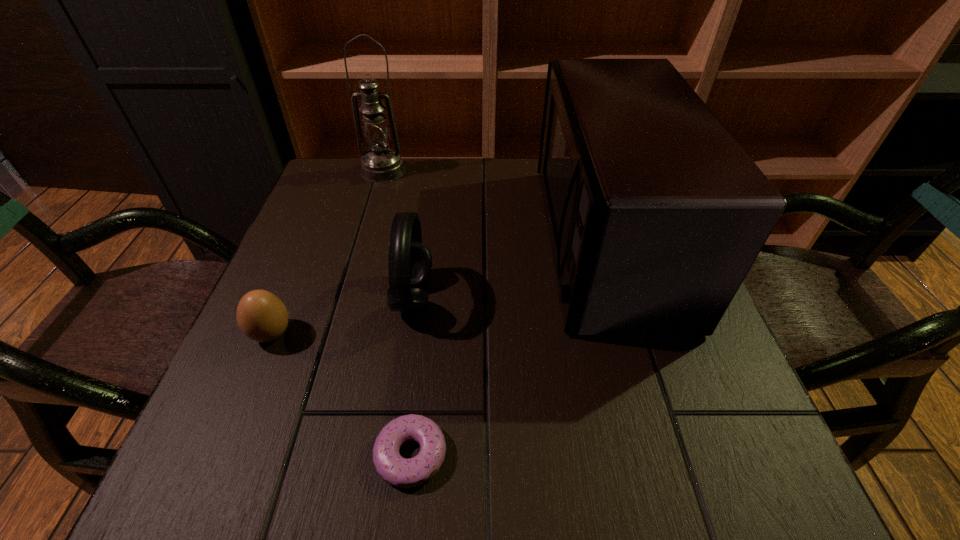
The height and width of the screenshot is (540, 960). Find the location of `unoccupied area between the leftmost object and the fourth object from right to left`. unoccupied area between the leftmost object and the fourth object from right to left is located at coordinates (327, 252).

Where is `vacant point located between the second shortest object and the doughnut`? vacant point located between the second shortest object and the doughnut is located at coordinates (342, 394).

Where is `free space between the microwave_oven and the second object from left to right`? free space between the microwave_oven and the second object from left to right is located at coordinates pyautogui.click(x=494, y=206).

Identify the location of free space between the third tallest object and the shortest object. (412, 376).

Image resolution: width=960 pixels, height=540 pixels. In order to click on blank region between the rightmost object and the second object from left to right in this screenshot , I will do `click(494, 206)`.

I want to click on blank region between the headset and the shortest object, so click(x=412, y=376).

Point out which object is positioned as the nearest to the second shortest object. Please provide its 2D coordinates. Your answer should be formatted as a tuple, i.e. [(x, y)], where the tuple contains the x and y coordinates of a point satisfying the conditions above.

[(410, 261)]

The image size is (960, 540). In order to click on object that can be found as the fourth closest to the oil lamp in this screenshot , I will do `click(394, 469)`.

You are a GUI agent. You are given a task and a screenshot of the screen. Output one action in this format:
    pyautogui.click(x=<x>, y=<y>)
    Task: Click on the free space in the image that satisfies the following two spatial constraints: 1. on the front-facing side of the microwave_oven; 2. on the front side of the nearest object
    This screenshot has width=960, height=540.
    Given the screenshot: What is the action you would take?
    pyautogui.click(x=670, y=454)

I want to click on vacant space that satisfies the following two spatial constraints: 1. on the earcups of the doughnut; 2. on the left side of the third shortest object, so click(391, 454).